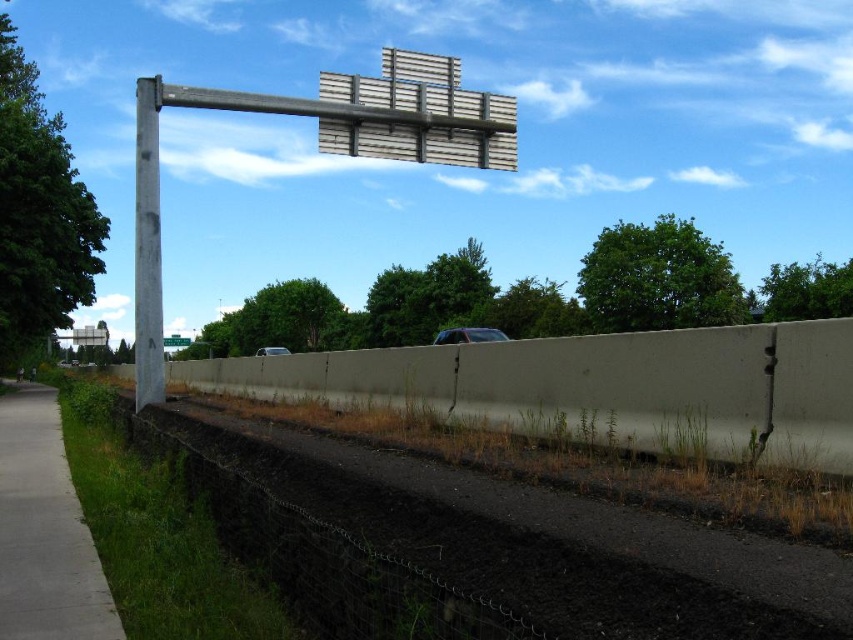
Question: Considering the real-world distances, which object is farthest from the gray metallic pole at upper center?

Choices:
 (A) dull gray asphalt at lower center
 (B) gray concrete sidewalk at lower left

Answer: (A)

Question: Does gray concrete pole at left have a greater width compared to shiny black car at center?

Choices:
 (A) no
 (B) yes

Answer: (B)

Question: Which object is the farthest from the dull gray asphalt at lower center?

Choices:
 (A) green plastic sign at upper center
 (B) gray concrete sidewalk at lower left
 (C) gray metallic pole at upper center
 (D) shiny black car at center

Answer: (A)

Question: Where is gray metallic pole at upper center located in relation to gray concrete sidewalk at lower left in the image?

Choices:
 (A) above
 (B) below

Answer: (A)

Question: Which point is farther from the camera taking this photo?

Choices:
 (A) coord(154,394)
 (B) coord(451,124)
 (C) coord(0,576)
 (D) coord(437,344)

Answer: (D)

Question: Does gray concrete pole at left have a lesser width compared to shiny black car at center?

Choices:
 (A) no
 (B) yes

Answer: (A)